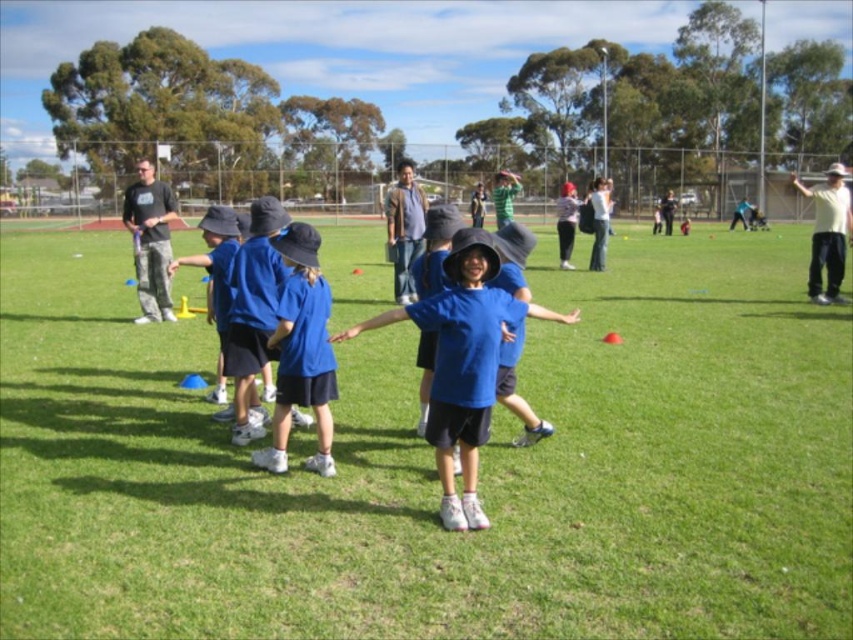
You are a photographer trying to capture a clear shot of the blue fabric shirt at center and the blue matte hat at center. Which one is closer to the camera?

The blue fabric shirt at center is in front of the blue matte hat at center, so the blue fabric shirt at center is closer to the camera.

You are a photographer standing at the edge of the grassy field. You want to capture a photo of both the blue fabric shirt at center and the blue matte shirt at center in the same frame. Given that your camera has a maximum focus range of 8 feet, will you be able to include both shirts in the photo without moving closer?

The distance between the blue fabric shirt at center and the blue matte shirt at center is 8.57 feet, which exceeds the camera maximum focus range of 8 feet. Therefore, you will not be able to include both shirts in the same frame without moving closer.

You are a photographer trying to capture a clear shot of the blue fabric shirt at center and the blue matte hat at center. Which object will appear larger in the photo?

The blue fabric shirt at center will appear larger in the photo because it is taller than the blue matte hat at center.